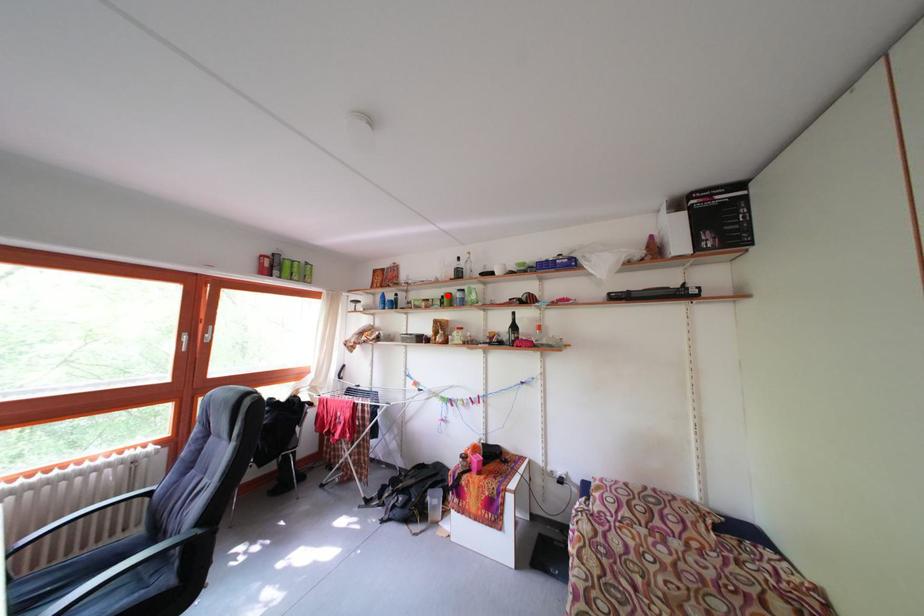
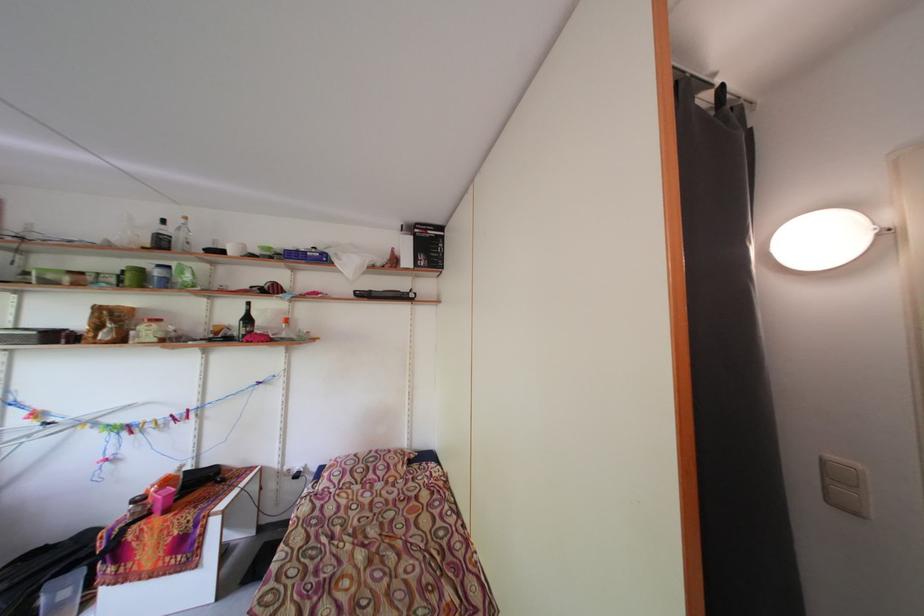
In the second image, find the point that corresponds to the highlighted location in the first image.

(127, 265)